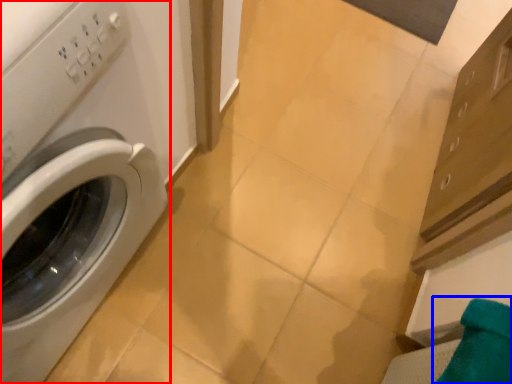
Question: Which object is closer to the camera taking this photo, washing machine (highlighted by a red box) or bath towel (highlighted by a blue box)?

Choices:
 (A) washing machine
 (B) bath towel

Answer: (A)